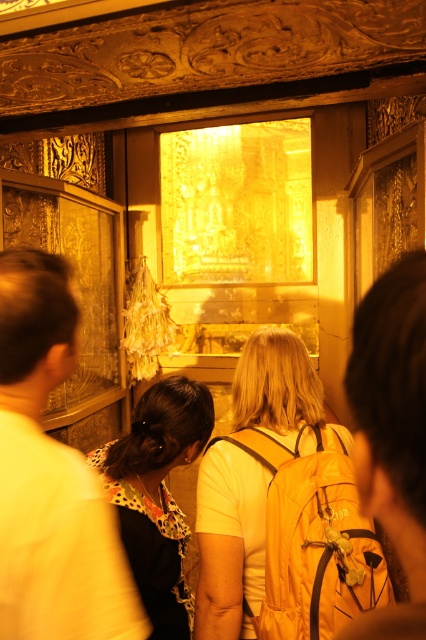
Is point (9, 468) less distant than point (175, 449)?

Yes, it is.

Which is behind, point (14, 259) or point (186, 616)?

Positioned behind is point (186, 616).

I want to click on polka dot blouse at center, so click(x=51, y=477).

Between point (386, 348) and point (111, 468), which one is positioned behind?

The point (111, 468) is behind.

Does yellow backpack at center have a greater height compared to floral-patterned blouse at center?

No, yellow backpack at center is not taller than floral-patterned blouse at center.

Measure the distance between yellow backpack at center and camera.

yellow backpack at center and camera are 17.42 inches apart.

Where is `yellow backpack at center`? yellow backpack at center is located at coordinates (391, 435).

Image resolution: width=426 pixels, height=640 pixels. What do you see at coordinates (51, 477) in the screenshot? I see `polka dot blouse at center` at bounding box center [51, 477].

Can you confirm if polka dot blouse at center is positioned to the right of yellow fabric backpack at center?

No, polka dot blouse at center is not to the right of yellow fabric backpack at center.

The height and width of the screenshot is (640, 426). What do you see at coordinates (51, 477) in the screenshot? I see `polka dot blouse at center` at bounding box center [51, 477].

You are a GUI agent. You are given a task and a screenshot of the screen. Output one action in this format:
    pyautogui.click(x=<x>, y=<y>)
    Task: Click on the polka dot blouse at center
    
    Given the screenshot: What is the action you would take?
    pyautogui.click(x=51, y=477)